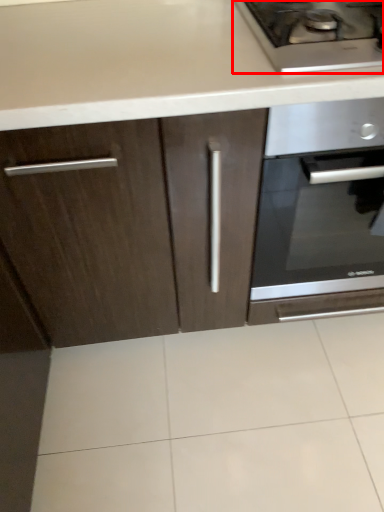
Question: In this image, where is gas stove (annotated by the red box) located relative to oven?

Choices:
 (A) left
 (B) right

Answer: (A)